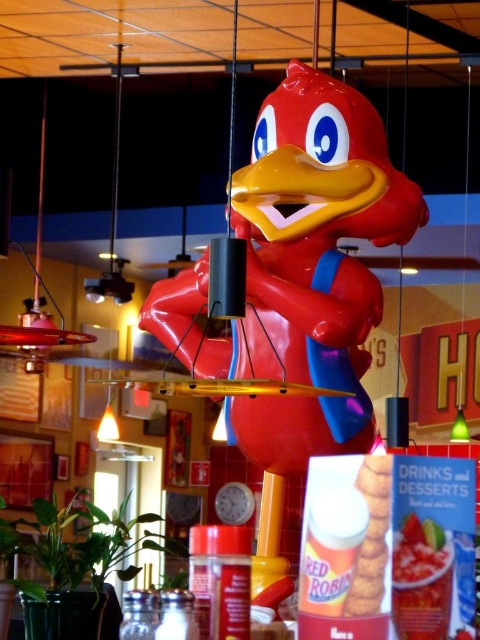
You are a customer at Red Robin restaurant and want to take a photo with the shiny plastic duck at center and the matte plastic french fries at center. If you want to ensure both are fully visible in the frame, which object should you position closer to the camera?

The shiny plastic duck at center is taller than the matte plastic french fries at center, so you should position the matte plastic french fries at center closer to the camera to ensure both are fully visible in the frame.

You are standing in the Red Robin restaurant and want to take a photo of the shiny plastic duck at center. Where should you position yourself to capture it in the frame?

The shiny plastic duck at center is located at the coordinates 0.450 on the x axis and 0.621 on the y axis, so you should position yourself facing the center area where the coordinates intersect to capture it in the frame.